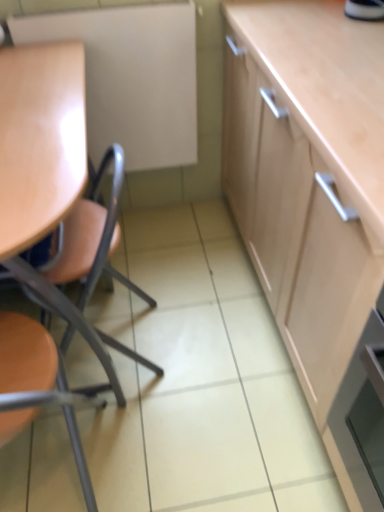
Question: Is matte white board at upper left at the left side of matte orange chair at left, which is the 2th chair from top to bottom?

Choices:
 (A) yes
 (B) no

Answer: (B)

Question: Can you confirm if matte white board at upper left is wider than matte orange chair at left, which is the 2th chair from top to bottom?

Choices:
 (A) no
 (B) yes

Answer: (A)

Question: From the image's perspective, is matte white board at upper left below matte orange chair at left, which is the 2th chair from top to bottom?

Choices:
 (A) no
 (B) yes

Answer: (A)

Question: Is matte white board at upper left behind matte orange chair at left, which is the 2th chair from top to bottom?

Choices:
 (A) yes
 (B) no

Answer: (A)

Question: Does matte white board at upper left touch matte orange chair at left, arranged as the 1th chair when ordered from the bottom?

Choices:
 (A) no
 (B) yes

Answer: (A)

Question: Is matte orange chair at left, arranged as the 1th chair when ordered from the bottom, in front of or behind matte wood chair at left, acting as the first chair starting from the top, in the image?

Choices:
 (A) behind
 (B) front

Answer: (B)

Question: From the image's perspective, is matte orange chair at left, which is the 2th chair from top to bottom, located above or below matte wood chair at left, positioned as the second chair in bottom-to-top order?

Choices:
 (A) below
 (B) above

Answer: (A)

Question: Is matte orange chair at left, which is the 2th chair from top to bottom, bigger or smaller than matte wood chair at left, positioned as the second chair in bottom-to-top order?

Choices:
 (A) big
 (B) small

Answer: (B)

Question: Is matte orange chair at left, arranged as the 1th chair when ordered from the bottom, situated inside matte wood chair at left, positioned as the second chair in bottom-to-top order, or outside?

Choices:
 (A) outside
 (B) inside

Answer: (A)

Question: Based on their positions, is matte white board at upper left located to the left or right of matte orange chair at left, arranged as the 1th chair when ordered from the bottom?

Choices:
 (A) left
 (B) right

Answer: (B)

Question: From a real-world perspective, relative to matte orange chair at left, which is the 2th chair from top to bottom, is matte white board at upper left vertically above or below?

Choices:
 (A) below
 (B) above

Answer: (B)

Question: From the image's perspective, is matte white board at upper left positioned above or below matte orange chair at left, which is the 2th chair from top to bottom?

Choices:
 (A) above
 (B) below

Answer: (A)

Question: Considering the positions of matte white board at upper left and matte orange chair at left, arranged as the 1th chair when ordered from the bottom, in the image, is matte white board at upper left wider or thinner than matte orange chair at left, arranged as the 1th chair when ordered from the bottom,?

Choices:
 (A) wide
 (B) thin

Answer: (B)

Question: Would you say matte wood chair at left, acting as the first chair starting from the top, is to the left or to the right of matte orange chair at left, which is the 2th chair from top to bottom, in the picture?

Choices:
 (A) right
 (B) left

Answer: (A)

Question: In terms of width, does matte wood chair at left, acting as the first chair starting from the top, look wider or thinner when compared to matte orange chair at left, arranged as the 1th chair when ordered from the bottom?

Choices:
 (A) wide
 (B) thin

Answer: (B)